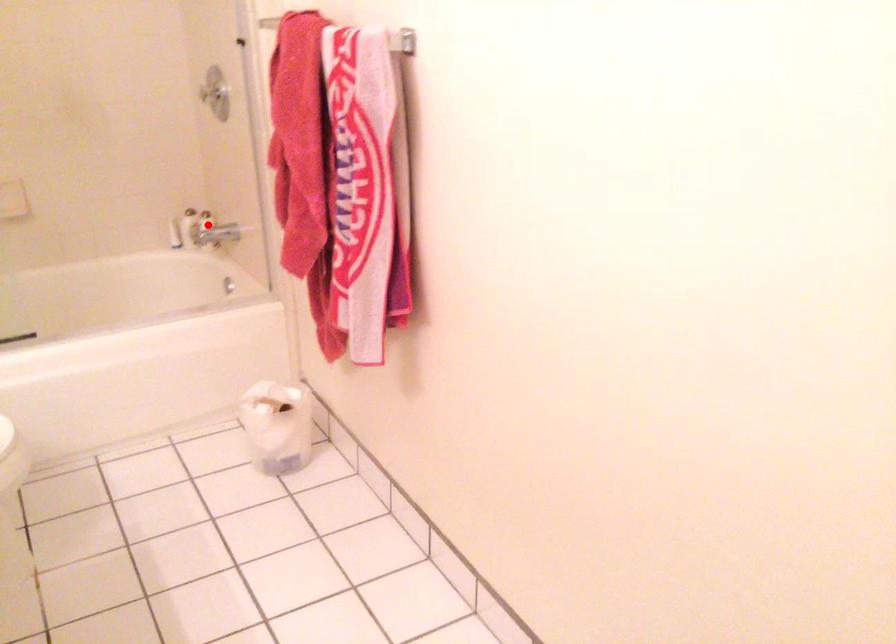
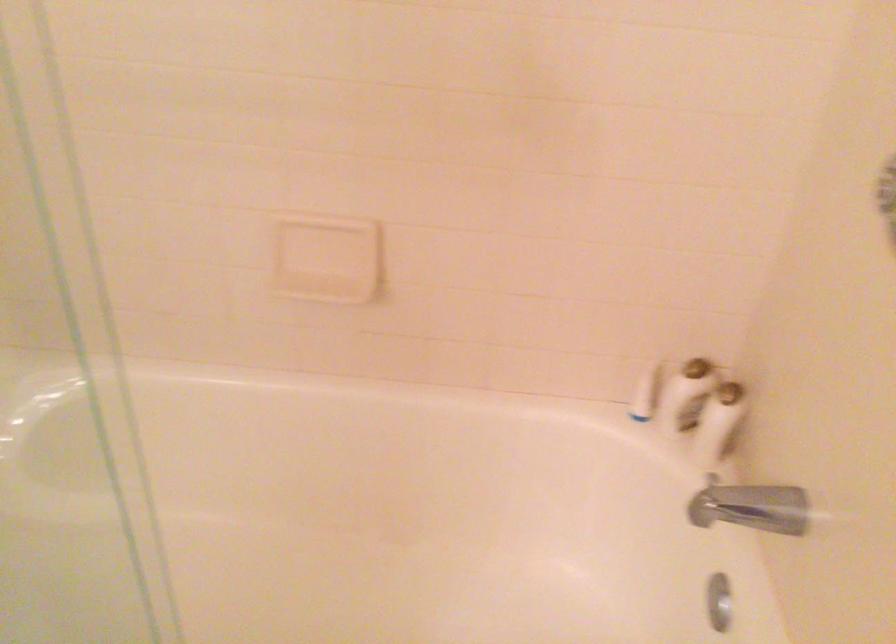
Question: I am providing you with two images of the same scene from different viewpoints. A red point is marked on the first image. Can you still see the location of the red point in image 2?

Choices:
 (A) Yes
 (B) No

Answer: (A)